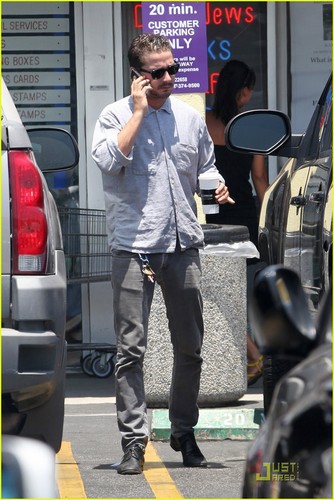
Locate an element on the screen. This screenshot has width=334, height=500. phone is located at coordinates (137, 73).